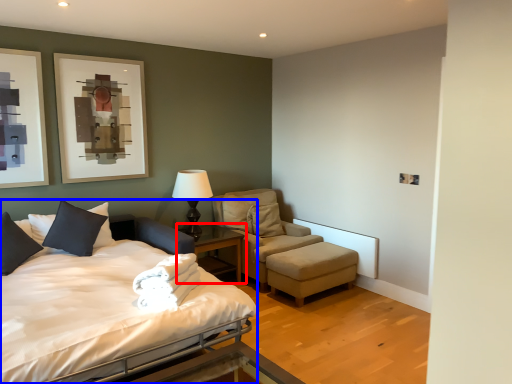
Question: Among these objects, which one is farthest to the camera, nightstand (highlighted by a red box) or bed (highlighted by a blue box)?

Choices:
 (A) nightstand
 (B) bed

Answer: (A)